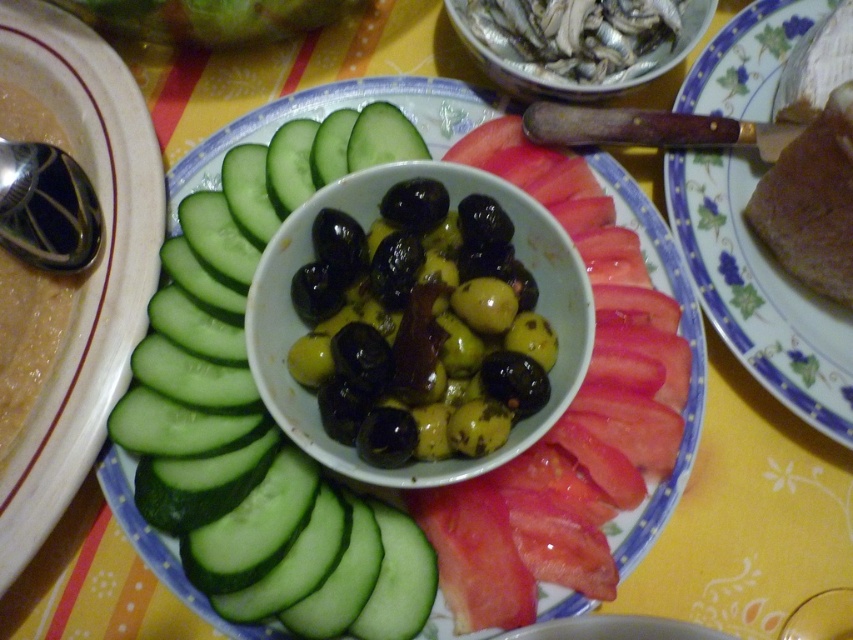
Who is more distant from viewer, (408, 136) or (723, 228)?

The point (723, 228) is more distant.

Between green smooth cucumber at left and brown matte bread at right, which one appears on the left side from the viewer's perspective?

Positioned to the left is green smooth cucumber at left.

Describe the element at coordinates (256, 417) in the screenshot. I see `green smooth cucumber at left` at that location.

Identify the location of green smooth cucumber at left. The width and height of the screenshot is (853, 640). (256, 417).